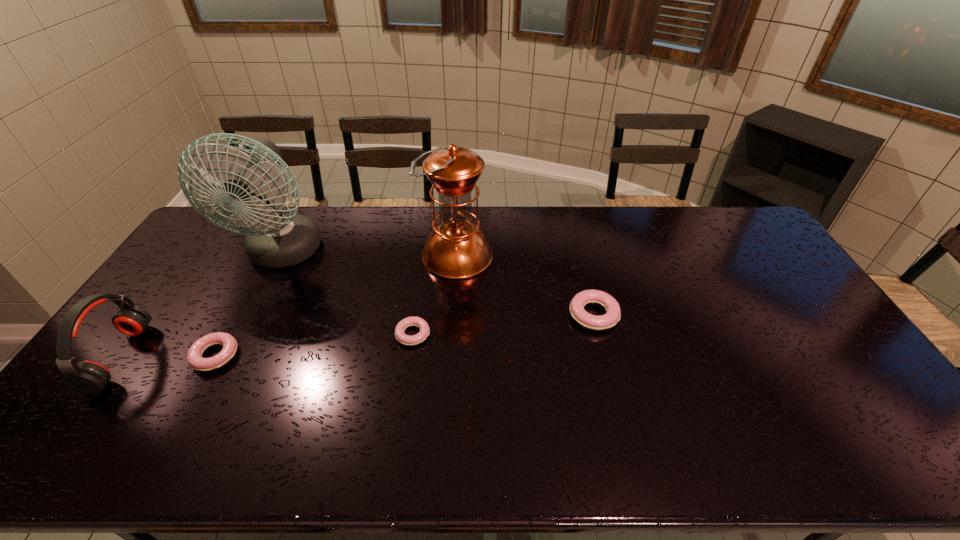
This screenshot has height=540, width=960. I want to click on free area in between the earphone and the fan, so click(x=202, y=306).

This screenshot has width=960, height=540. Identify the location of free space between the fan and the earphone. (202, 306).

Locate an element on the screen. This screenshot has height=540, width=960. vacant point located between the second shortest object and the oil lamp is located at coordinates click(336, 306).

Where is `free space between the second doughnut from left to right and the fan`? This screenshot has width=960, height=540. free space between the second doughnut from left to right and the fan is located at coordinates (348, 294).

At what (x,y) coordinates should I click in order to perform the action: click on vacant area that lies between the third shortest object and the oil lamp. Please return your answer as a coordinate pair (x, y). Looking at the image, I should click on (525, 286).

This screenshot has width=960, height=540. What are the coordinates of `object that ranks as the fifth closest to the second tallest doughnut` in the screenshot? It's located at (613, 313).

Select which object appears as the fifth closest to the earphone. Please provide its 2D coordinates. Your answer should be formatted as a tuple, i.e. [(x, y)], where the tuple contains the x and y coordinates of a point satisfying the conditions above.

[(613, 313)]

Find the location of a particular element. The height and width of the screenshot is (540, 960). the second closest doughnut to the oil lamp is located at coordinates (613, 313).

Point out which doughnut is positioned as the second nearest to the third shortest object. Please provide its 2D coordinates. Your answer should be formatted as a tuple, i.e. [(x, y)], where the tuple contains the x and y coordinates of a point satisfying the conditions above.

[(194, 356)]

Find the location of a particular element. Image resolution: width=960 pixels, height=540 pixels. blank area in the image that satisfies the following two spatial constraints: 1. in front of the tallest doughnut where the airflow is directed; 2. on the left side of the fan is located at coordinates (252, 315).